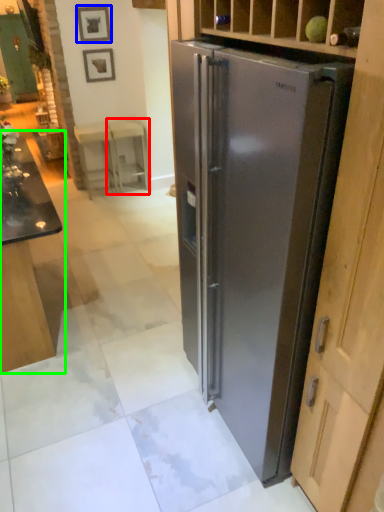
Question: Estimate the real-world distances between objects in this image. Which object is farther from stool (highlighted by a red box), picture frame (highlighted by a blue box) or table (highlighted by a green box)?

Choices:
 (A) picture frame
 (B) table

Answer: (B)